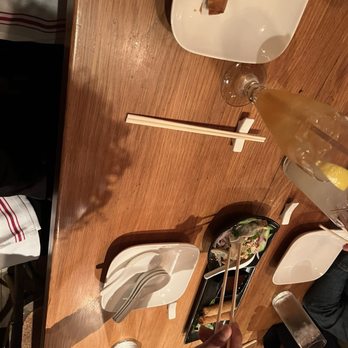
Image resolution: width=348 pixels, height=348 pixels. Find the location of `chop sticks`. chop sticks is located at coordinates (204, 128), (220, 296), (235, 295), (337, 234).